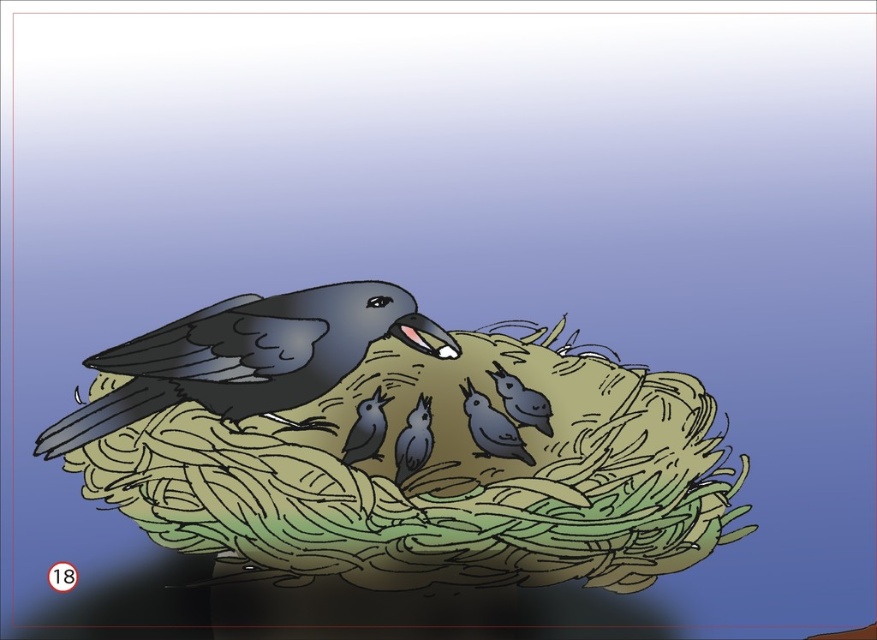
Question: In this image, where is smooth gray birds at center located relative to matte black bird at center?

Choices:
 (A) below
 (B) above

Answer: (B)

Question: Is green woven nest at center below matte black bird at center?

Choices:
 (A) yes
 (B) no

Answer: (A)

Question: Which point is closer to the camera?

Choices:
 (A) (529, 540)
 (B) (132, 376)
 (C) (347, 458)
 (D) (410, 449)

Answer: (A)

Question: Can you confirm if matte gray bird at center is thinner than matte black bird at center?

Choices:
 (A) no
 (B) yes

Answer: (B)

Question: Which point appears closest to the camera in this image?

Choices:
 (A) (510, 410)
 (B) (364, 413)
 (C) (290, 403)

Answer: (C)

Question: Which point is closer to the camera?

Choices:
 (A) (503, 388)
 (B) (108, 426)
 (C) (489, 452)
 (D) (297, 481)

Answer: (D)